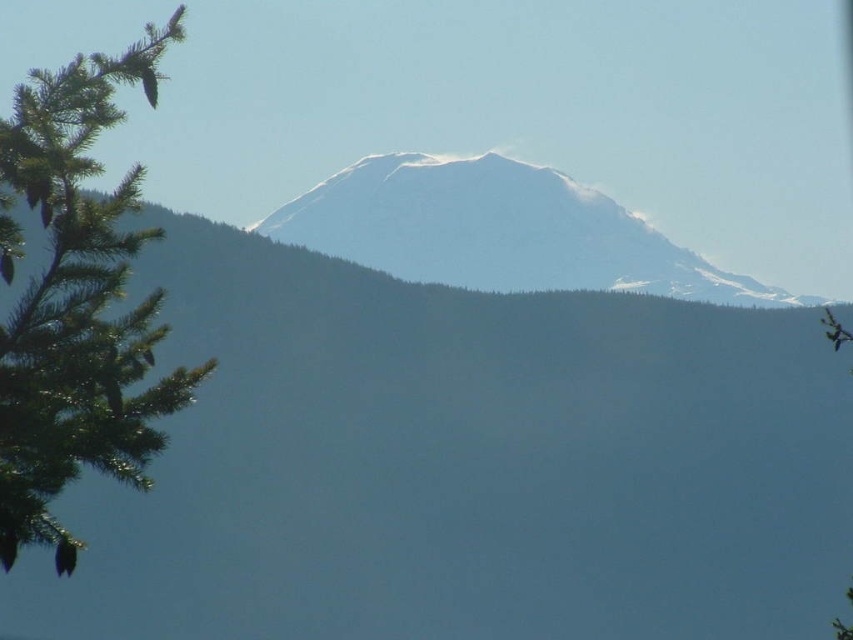
Can you confirm if green needle-like leaves at left is bigger than white snow-covered peak at center?

Yes.

This screenshot has width=853, height=640. Find the location of `green needle-like leaves at left`. green needle-like leaves at left is located at coordinates (76, 301).